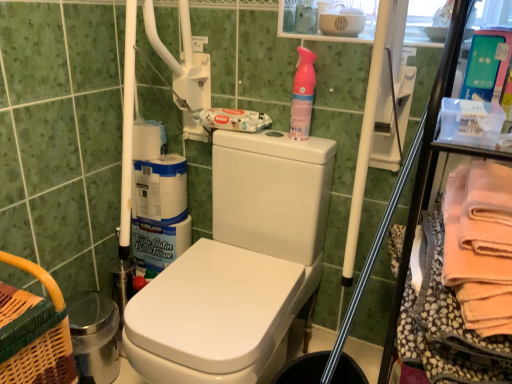
Question: Is pink plastic spray bottle at upper right wider or thinner than soft peach towel at right?

Choices:
 (A) wide
 (B) thin

Answer: (B)

Question: From a real-world perspective, is pink plastic spray bottle at upper right positioned above or below soft peach towel at right?

Choices:
 (A) below
 (B) above

Answer: (B)

Question: Considering the relative positions of pink plastic spray bottle at upper right and soft peach towel at right in the image provided, is pink plastic spray bottle at upper right to the left or to the right of soft peach towel at right?

Choices:
 (A) right
 (B) left

Answer: (B)

Question: From a real-world perspective, is soft peach towel at right above or below pink plastic spray bottle at upper right?

Choices:
 (A) above
 (B) below

Answer: (B)

Question: Looking at their shapes, would you say soft peach towel at right is wider or thinner than pink plastic spray bottle at upper right?

Choices:
 (A) wide
 (B) thin

Answer: (A)

Question: Considering their positions, is soft peach towel at right located in front of or behind pink plastic spray bottle at upper right?

Choices:
 (A) behind
 (B) front

Answer: (B)

Question: Considering the positions of point (401, 309) and point (310, 105), is point (401, 309) closer or farther from the camera than point (310, 105)?

Choices:
 (A) farther
 (B) closer

Answer: (B)